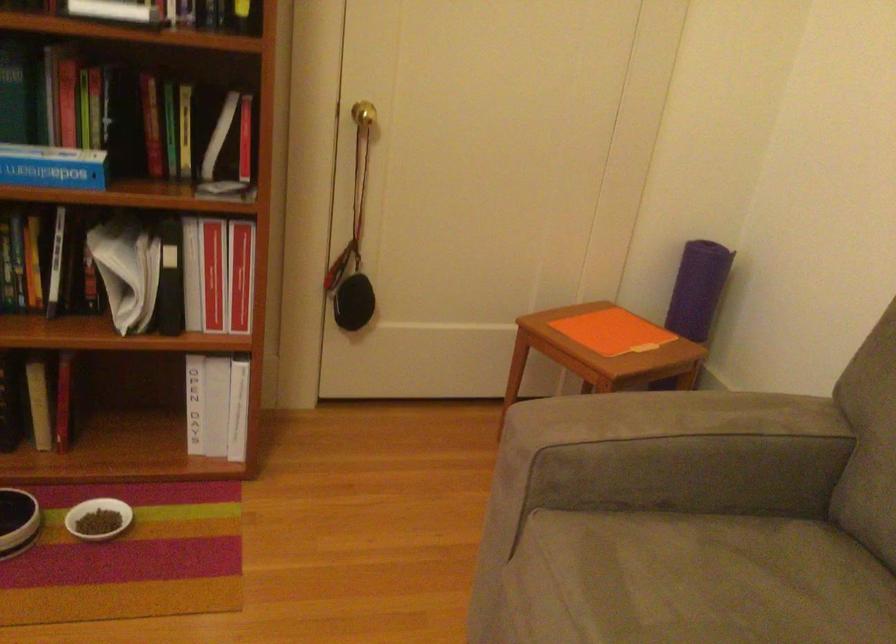
Describe the element at coordinates (716, 580) in the screenshot. The height and width of the screenshot is (644, 896). I see `the sofa sitting surface` at that location.